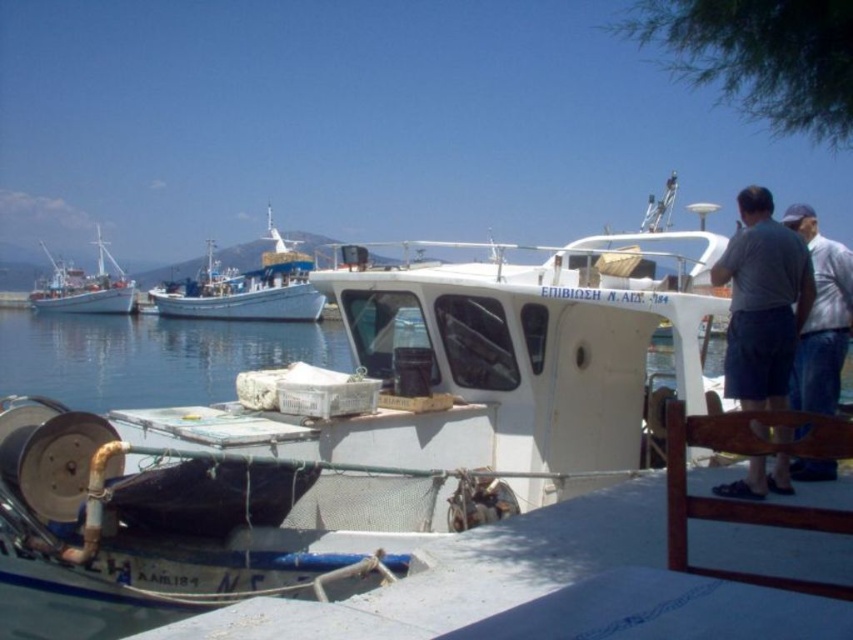
Who is shorter, gray cotton shirt at right or white matte fishing boat at left?

gray cotton shirt at right is shorter.

Measure the distance between gray cotton shirt at right and white matte fishing boat at left.

gray cotton shirt at right and white matte fishing boat at left are 47.48 meters apart from each other.

Who is more distant from viewer, (804, 236) or (53, 260)?

The point (53, 260) is more distant.

You are a GUI agent. You are given a task and a screenshot of the screen. Output one action in this format:
    pyautogui.click(x=<x>, y=<y>)
    Task: Click on the gray cotton shirt at right
    
    Given the screenshot: What is the action you would take?
    pyautogui.click(x=821, y=317)

Is dark blue shorts at right above blue painted wooden fishing boat at center?

Incorrect, dark blue shorts at right is not positioned above blue painted wooden fishing boat at center.

Is point (767, 202) closer to viewer compared to point (183, 296)?

Yes, point (767, 202) is in front of point (183, 296).

Is point (741, 404) behind point (215, 285)?

No, (741, 404) is closer to viewer.

Identify the location of dark blue shorts at right. (762, 301).

Is dark blue shorts at right to the left of white matte fishing boat at left from the viewer's perspective?

No, dark blue shorts at right is not to the left of white matte fishing boat at left.

Between dark blue shorts at right and white matte fishing boat at left, which one appears on the right side from the viewer's perspective?

From the viewer's perspective, dark blue shorts at right appears more on the right side.

Is point (769, 272) in front of point (99, 228)?

That is True.

The width and height of the screenshot is (853, 640). What are the coordinates of `dark blue shorts at right` in the screenshot? It's located at pos(762,301).